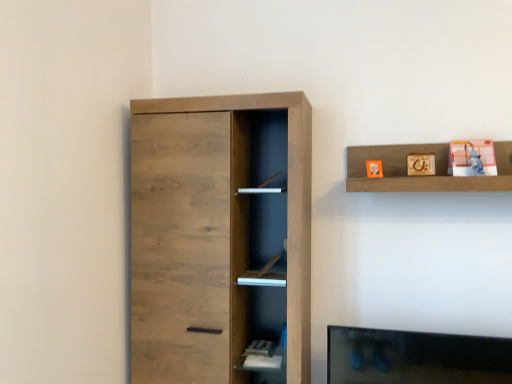
Question: From the image's perspective, is wooden shelf at upper right over matte orange cube at upper center, arranged as the first toy when viewed from the left?

Choices:
 (A) no
 (B) yes

Answer: (B)

Question: Can we say wooden shelf at upper right lies outside matte orange cube at upper center, arranged as the first toy when viewed from the left?

Choices:
 (A) yes
 (B) no

Answer: (A)

Question: Is wooden shelf at upper right at the left side of matte orange cube at upper center, arranged as the first toy when viewed from the left?

Choices:
 (A) no
 (B) yes

Answer: (A)

Question: From a real-world perspective, is wooden shelf at upper right physically above matte orange cube at upper center, which is the second toy in right-to-left order?

Choices:
 (A) no
 (B) yes

Answer: (B)

Question: Does wooden shelf at upper right appear on the right side of matte orange cube at upper center, arranged as the first toy when viewed from the left?

Choices:
 (A) yes
 (B) no

Answer: (A)

Question: Is wooden shelf at upper right smaller than matte orange cube at upper center, which is the second toy in right-to-left order?

Choices:
 (A) no
 (B) yes

Answer: (A)

Question: From the image's perspective, is wooden shelf at upper right on top of natural wood cupboard at left?

Choices:
 (A) no
 (B) yes

Answer: (B)

Question: Is the position of wooden shelf at upper right less distant than that of natural wood cupboard at left?

Choices:
 (A) no
 (B) yes

Answer: (B)

Question: Considering the relative sizes of wooden shelf at upper right and natural wood cupboard at left in the image provided, is wooden shelf at upper right taller than natural wood cupboard at left?

Choices:
 (A) no
 (B) yes

Answer: (A)

Question: Does wooden shelf at upper right touch natural wood cupboard at left?

Choices:
 (A) no
 (B) yes

Answer: (A)

Question: From a real-world perspective, is wooden shelf at upper right physically above natural wood cupboard at left?

Choices:
 (A) yes
 (B) no

Answer: (A)

Question: Does wooden shelf at upper right turn towards natural wood cupboard at left?

Choices:
 (A) no
 (B) yes

Answer: (A)

Question: Does wooden shelf at upper right appear on the left side of matte plastic photo frame at upper right, positioned as the second toy in left-to-right order?

Choices:
 (A) no
 (B) yes

Answer: (B)